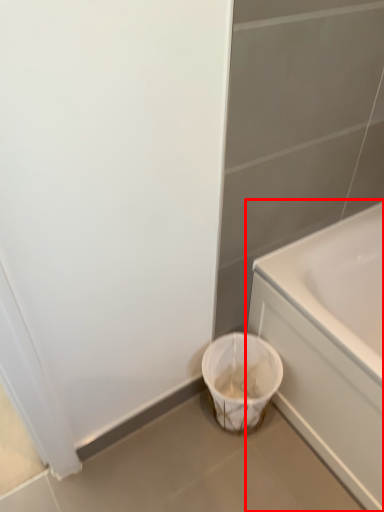
Question: From the image's perspective, where is bathtub (annotated by the red box) located relative to laundry basket?

Choices:
 (A) below
 (B) above

Answer: (B)